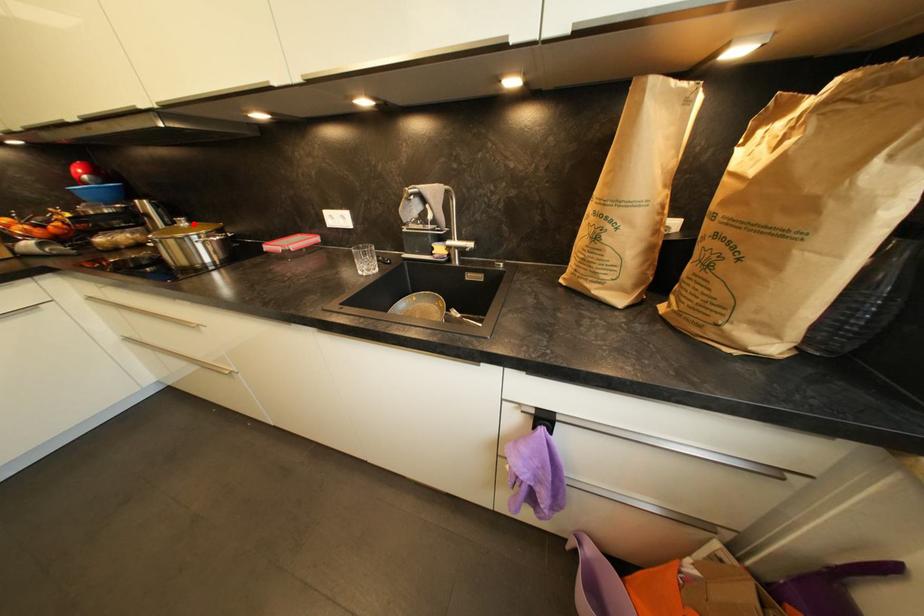
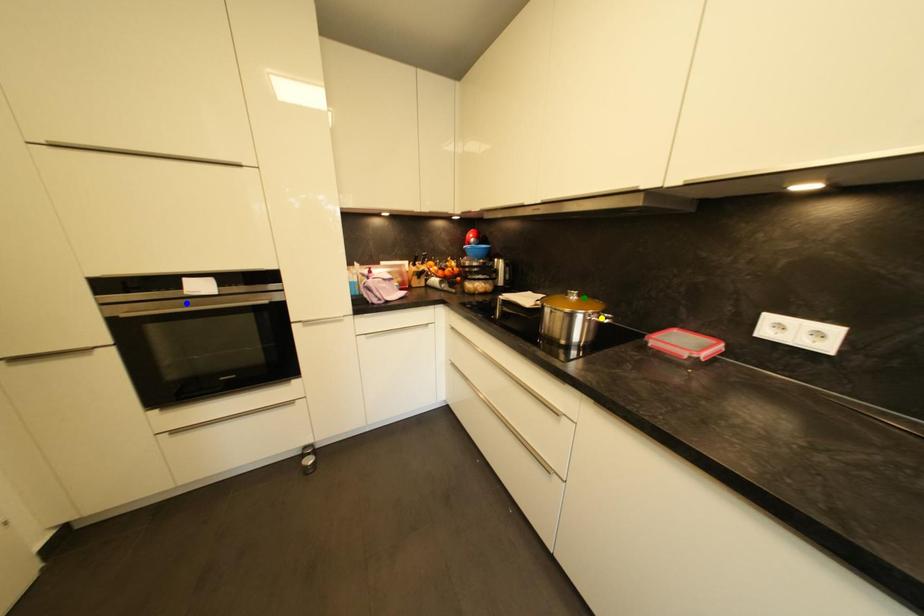
Question: I am providing you with two images of the same scene from different viewpoints. A red point is marked on the first image. You are given multiple points on the second image. Which point in image 2 is actually the same real-world point as the red point in image 1?

Choices:
 (A) green point
 (B) yellow point
 (C) blue point

Answer: (A)